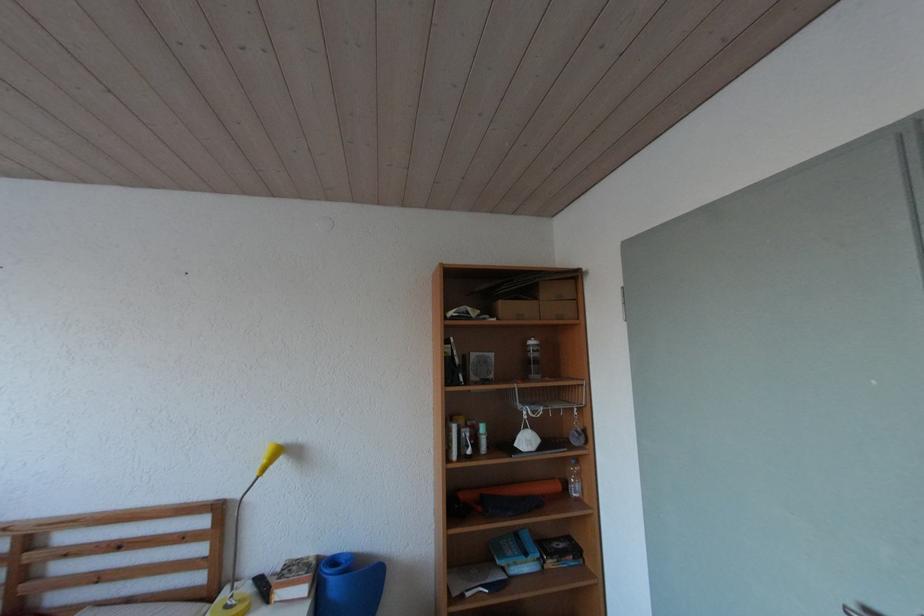
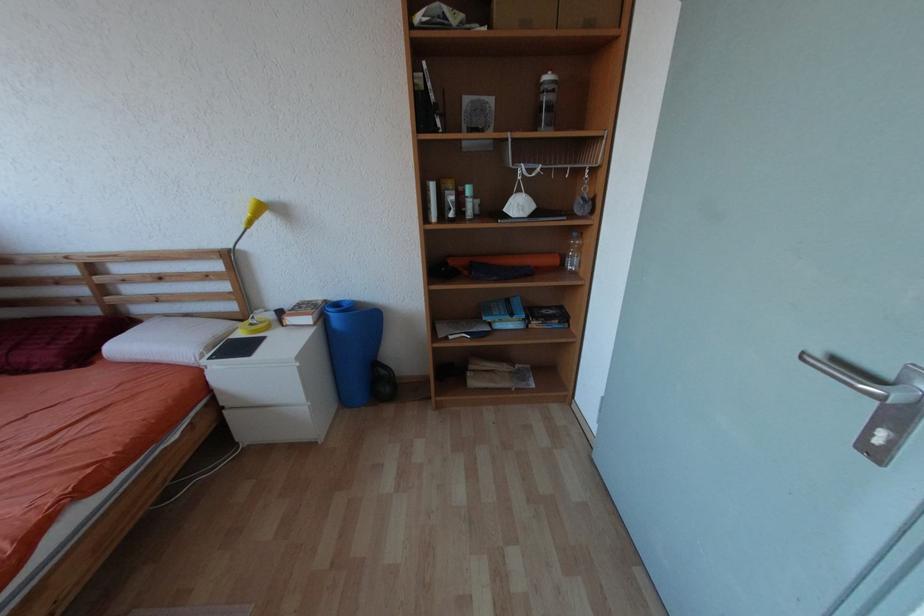
Question: How did the camera likely rotate?

Choices:
 (A) Left
 (B) Right
 (C) Up
 (D) Down

Answer: (D)